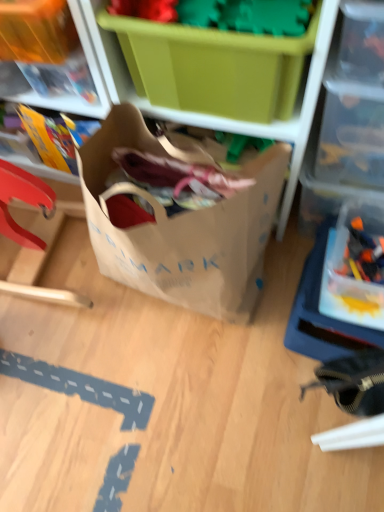
Where is `free space that is to the left of translucent plastic toy at right`? The height and width of the screenshot is (512, 384). free space that is to the left of translucent plastic toy at right is located at coordinates (327, 275).